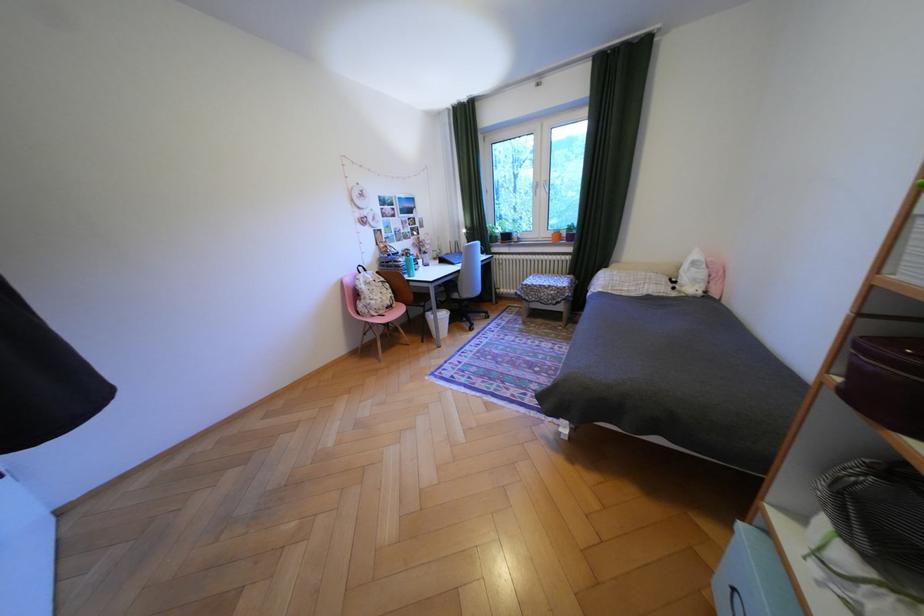
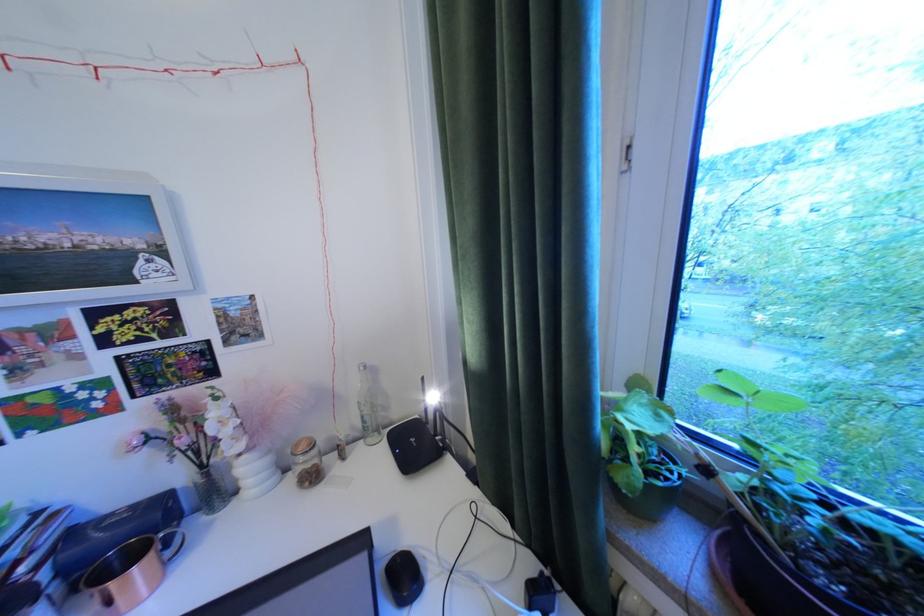
Question: The images are taken continuously from a first-person perspective. In which direction are you moving?

Choices:
 (A) Left
 (B) Right
 (C) Forward
 (D) Backward

Answer: (C)